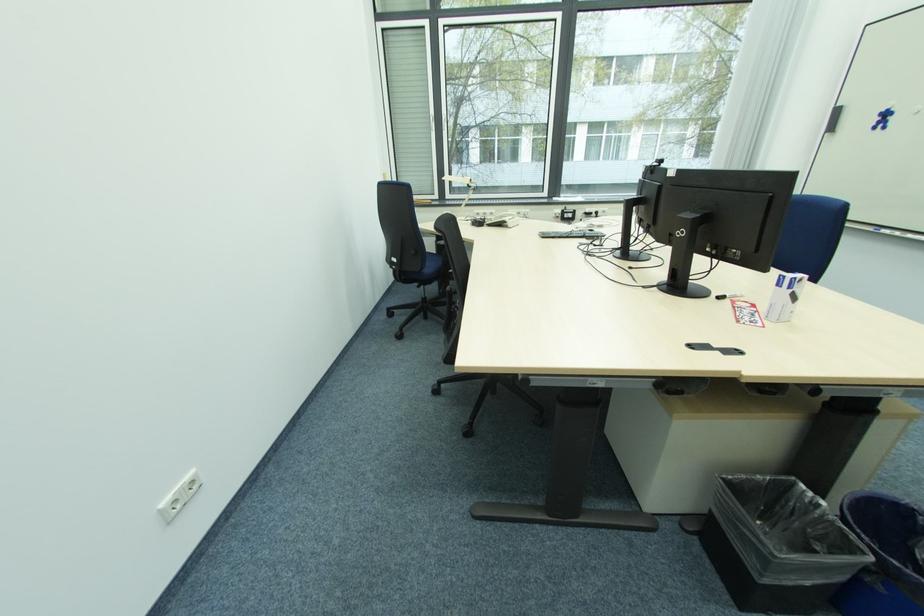
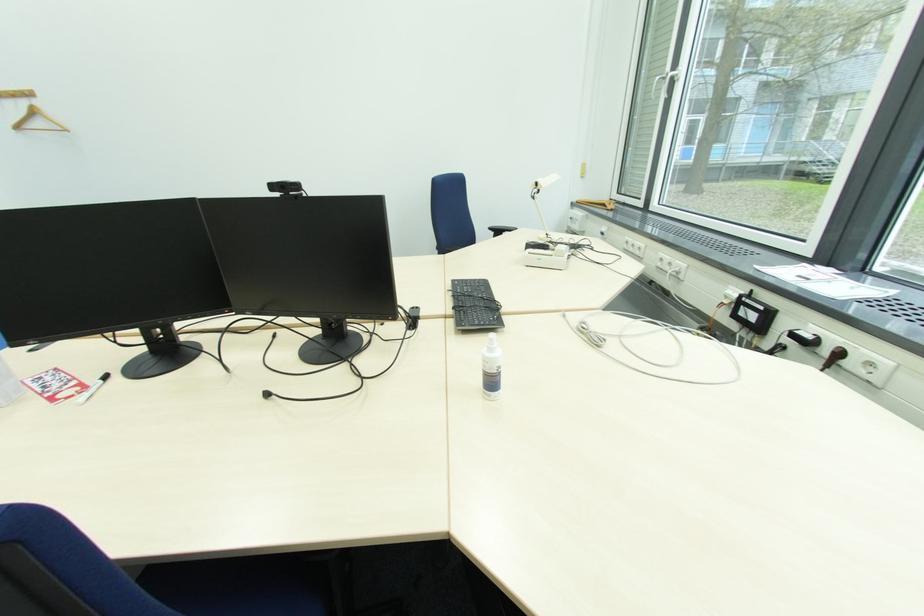
Question: I am providing you with two images of the same scene from different viewpoints. Which of the following objects are not visible in image2?

Choices:
 (A) fax machine button
 (B) wooden coat hanger
 (C) telephone handset
 (D) blue chair sitting surface

Answer: (D)